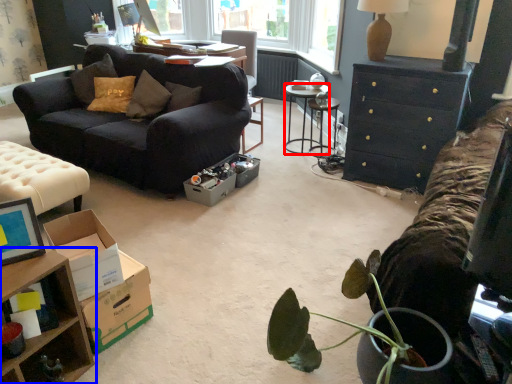
Question: Which object appears closest to the camera in this image, desk (highlighted by a red box) or table (highlighted by a blue box)?

Choices:
 (A) desk
 (B) table

Answer: (B)